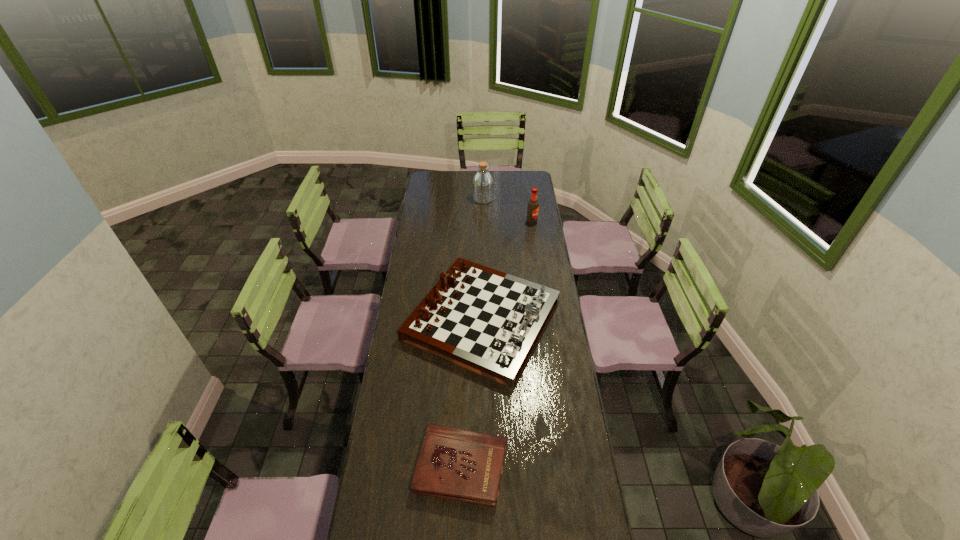
Where is `gameboard at the left edge`? gameboard at the left edge is located at coordinates (487, 321).

You are a GUI agent. You are given a task and a screenshot of the screen. Output one action in this format:
    pyautogui.click(x=<x>, y=<y>)
    Task: Click on the hardback book situated at the left edge
    The height and width of the screenshot is (540, 960).
    Given the screenshot: What is the action you would take?
    pyautogui.click(x=457, y=464)

Locate an element on the screen. beer bottle present at the right edge is located at coordinates (533, 206).

Locate an element on the screen. gameboard at the right edge is located at coordinates (487, 321).

What are the coordinates of `vacant space at the far edge of the desktop` in the screenshot? It's located at (468, 179).

Identify the location of free spot at the left edge of the desktop. The image size is (960, 540). (406, 286).

Where is `vacant space at the right edge`? vacant space at the right edge is located at coordinates (537, 270).

In the image, there is a desktop. Identify the location of vacant space at the far left corner. (428, 180).

I want to click on free space at the far right corner of the desktop, so click(533, 181).

Where is `free space between the nearest object and the third farthest object`? This screenshot has height=540, width=960. free space between the nearest object and the third farthest object is located at coordinates (471, 393).